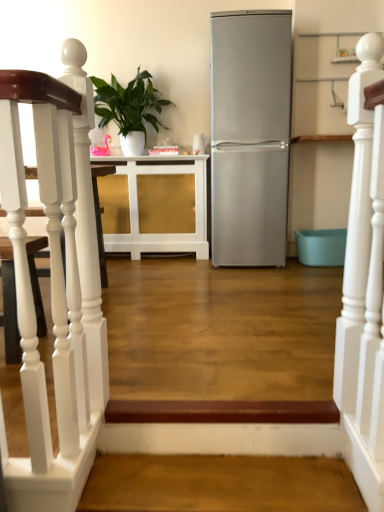
Question: Is white wooden railing at upper right at the left side of satin silver refrigerator at center?

Choices:
 (A) yes
 (B) no

Answer: (B)

Question: Are white wooden railing at upper right and satin silver refrigerator at center beside each other?

Choices:
 (A) no
 (B) yes

Answer: (A)

Question: Considering the relative sizes of white wooden railing at upper right and satin silver refrigerator at center in the image provided, is white wooden railing at upper right shorter than satin silver refrigerator at center?

Choices:
 (A) yes
 (B) no

Answer: (A)

Question: Is white wooden railing at upper right further to camera compared to satin silver refrigerator at center?

Choices:
 (A) yes
 (B) no

Answer: (B)

Question: From the image's perspective, is white wooden railing at upper right below satin silver refrigerator at center?

Choices:
 (A) no
 (B) yes

Answer: (B)

Question: Does white wooden railing at upper right have a lesser width compared to satin silver refrigerator at center?

Choices:
 (A) yes
 (B) no

Answer: (A)

Question: Does brown wood stairwell at lower center, the 2th stairwell when ordered from top to bottom, appear on the right side of white wooden staircase at left, placed as the second stairwell when sorted from bottom to top?

Choices:
 (A) no
 (B) yes

Answer: (B)

Question: Are brown wood stairwell at lower center, the first stairwell positioned from the bottom, and white wooden staircase at left, acting as the 1th stairwell starting from the left, located far from each other?

Choices:
 (A) yes
 (B) no

Answer: (B)

Question: Can you confirm if brown wood stairwell at lower center, the first stairwell viewed from the right, is taller than white wooden staircase at left, placed as the second stairwell when sorted from bottom to top?

Choices:
 (A) yes
 (B) no

Answer: (B)

Question: From the image's perspective, is brown wood stairwell at lower center, the first stairwell viewed from the right, on white wooden staircase at left, acting as the 1th stairwell starting from the left?

Choices:
 (A) yes
 (B) no

Answer: (B)

Question: Does brown wood stairwell at lower center, the 2th stairwell when ordered from top to bottom, have a lesser height compared to white wooden staircase at left, which appears as the 2th stairwell when viewed from the right?

Choices:
 (A) yes
 (B) no

Answer: (A)

Question: Is brown wood stairwell at lower center, which is the 2th stairwell in left-to-right order, bigger than white wooden staircase at left, which appears as the 2th stairwell when viewed from the right?

Choices:
 (A) no
 (B) yes

Answer: (A)

Question: Is brown wood stairwell at lower center, which is the 2th stairwell in left-to-right order, far away from white glossy cabinet at center?

Choices:
 (A) no
 (B) yes

Answer: (B)